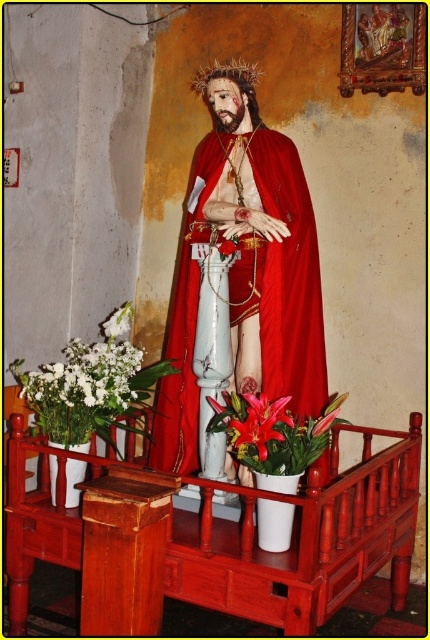
Question: Is matte pink lilies at center below pink matte lily at center?

Choices:
 (A) no
 (B) yes

Answer: (B)

Question: Can you confirm if matte red cape at center is positioned to the left of white matte flowers at lower left?

Choices:
 (A) no
 (B) yes

Answer: (A)

Question: Is wooden rail at center thinner than matte red cape at center?

Choices:
 (A) no
 (B) yes

Answer: (A)

Question: Which point is closer to the camera?

Choices:
 (A) white matte flowers at lower left
 (B) pink matte lily at center
 (C) matte pink lilies at center

Answer: (C)

Question: Which point is closer to the camera taking this photo?

Choices:
 (A) (249, 461)
 (B) (230, 241)
 (C) (328, 428)

Answer: (A)

Question: Which of these objects is positioned closest to the white matte flowers at lower left?

Choices:
 (A) pink matte lily at center
 (B) lustrous pink lily at center
 (C) matte red cape at center
 (D) wooden rail at center

Answer: (C)